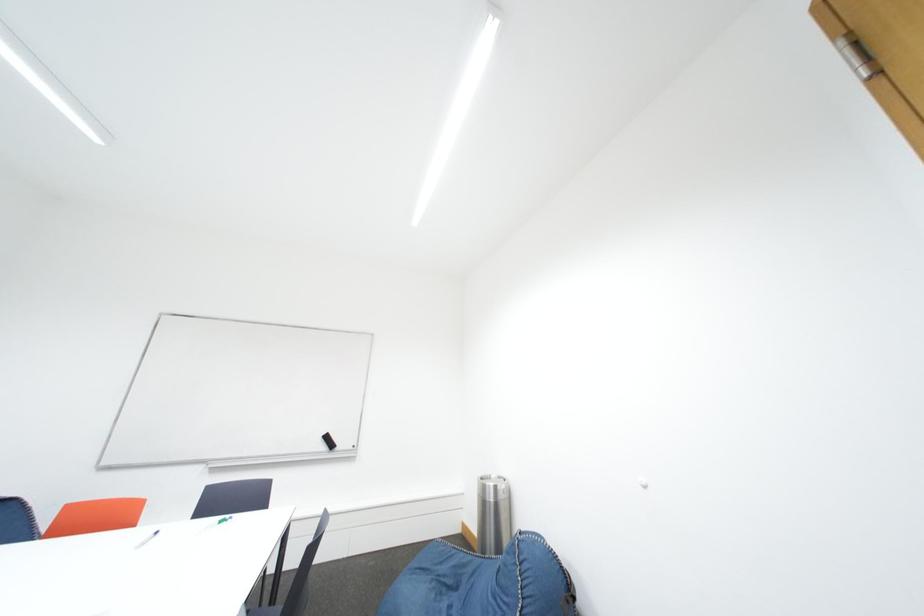
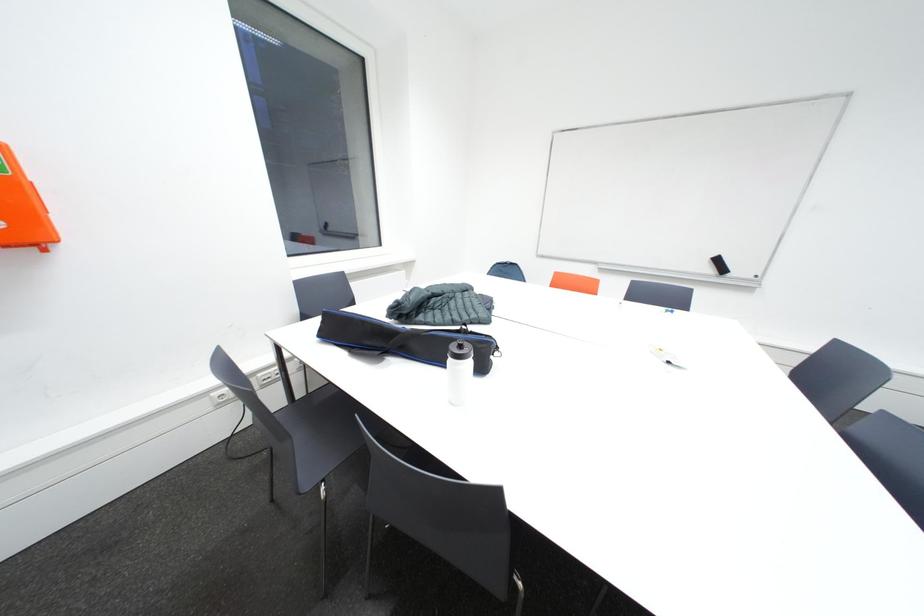
In the scene shown: The first image is from the beginning of the video and the second image is from the end. How did the camera likely rotate when shooting the video?

The rotation direction of the camera is left-down.